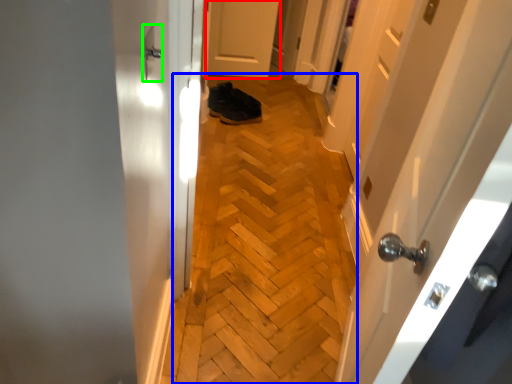
Question: Which object is the farthest from door (highlighted by a red box)? Choose among these: corridor (highlighted by a blue box) or door handle (highlighted by a green box).

Choices:
 (A) corridor
 (B) door handle

Answer: (B)